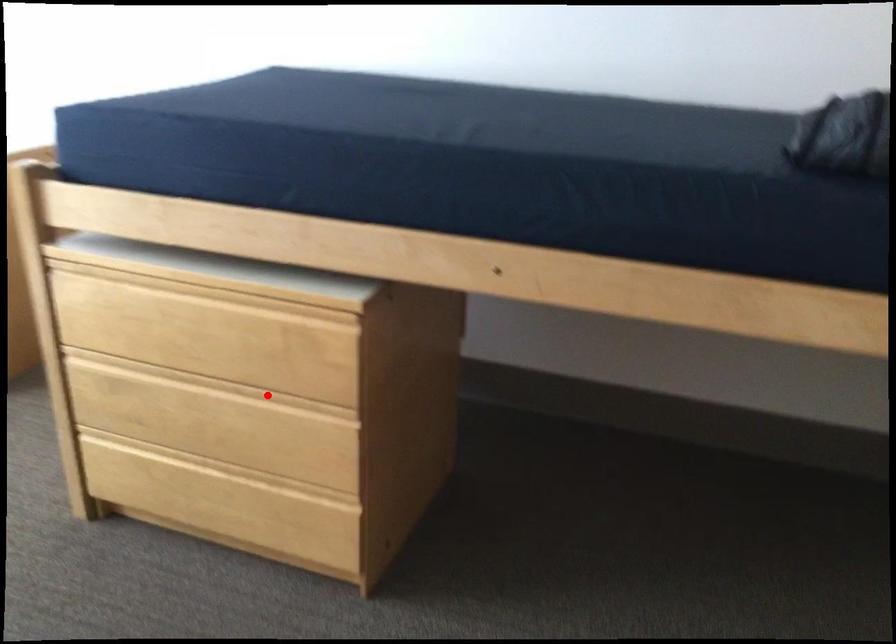
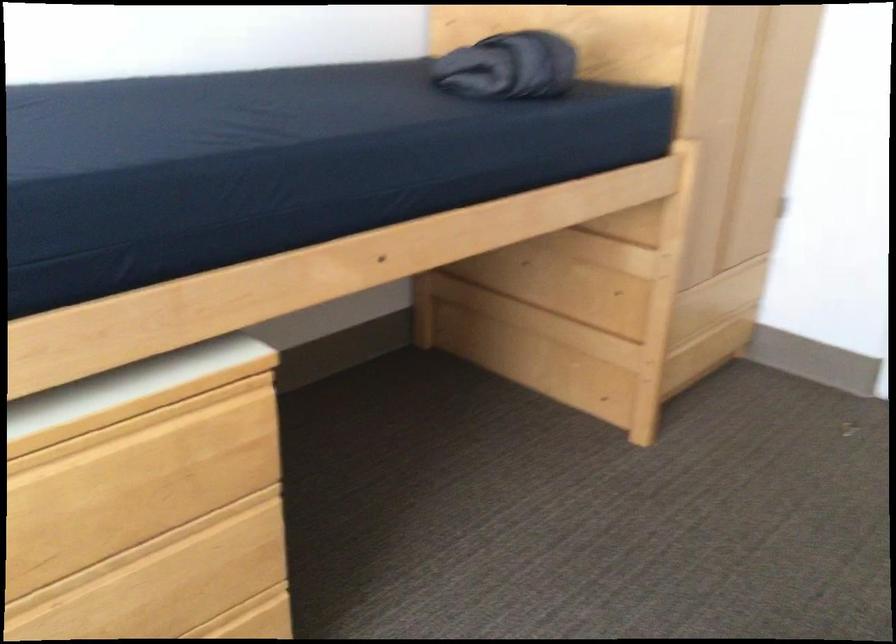
The point at the highlighted location is marked in the first image. Where is the corresponding point in the second image?

(135, 554)